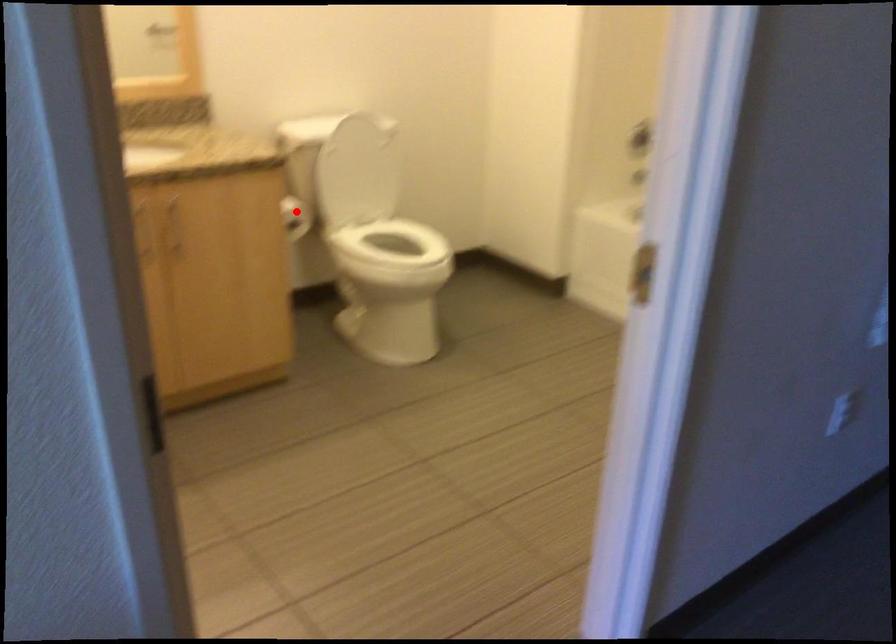
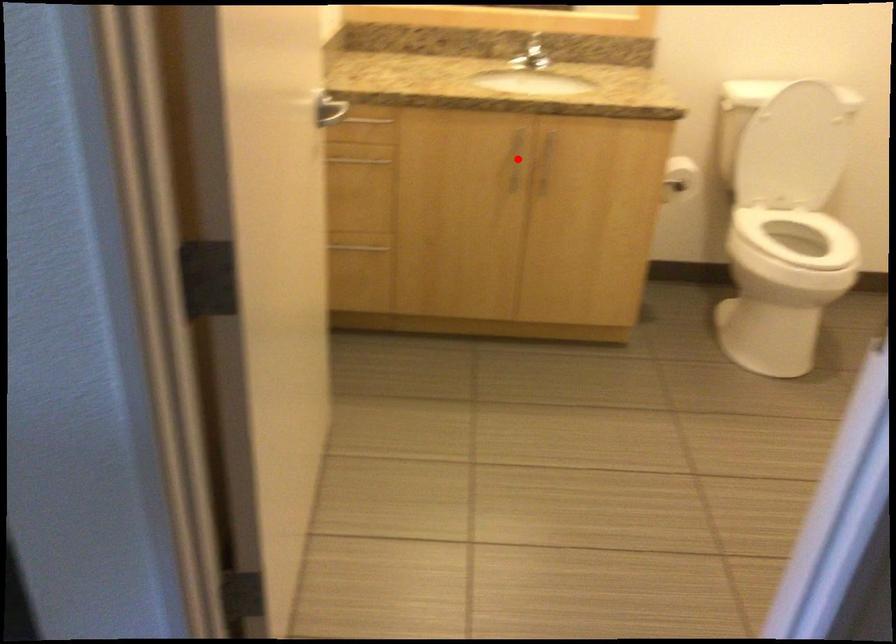
I am providing you with two images of the same scene from different viewpoints. A red point is marked on the first image and another point is marked on the second image. Is the marked point in image1 the same physical position as the marked point in image2?

No